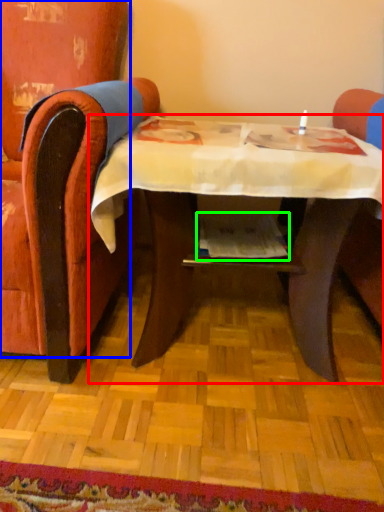
Question: Based on their relative distances, which object is nearer to table (highlighted by a red box)? Choose from chair (highlighted by a blue box) and magazine (highlighted by a green box).

Choices:
 (A) chair
 (B) magazine

Answer: (B)